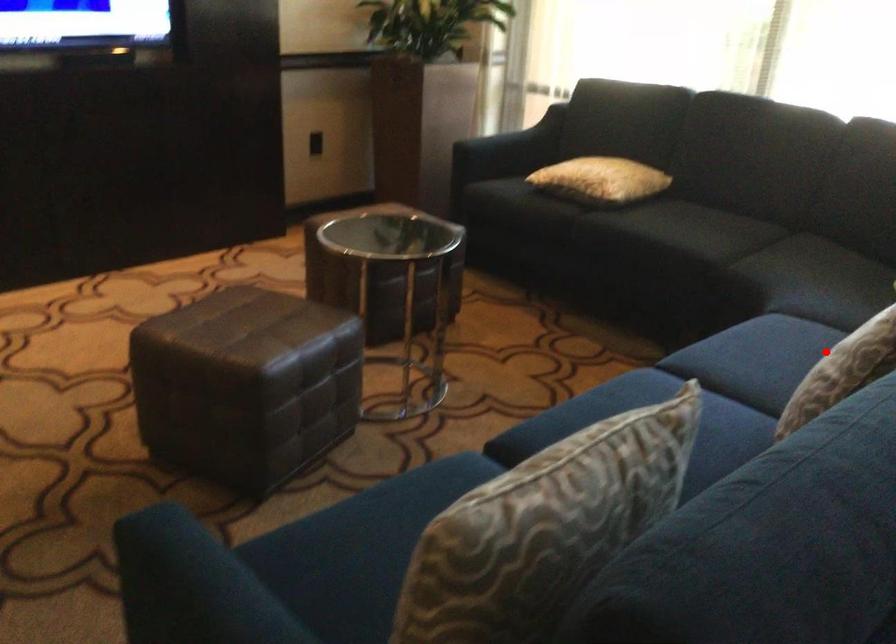
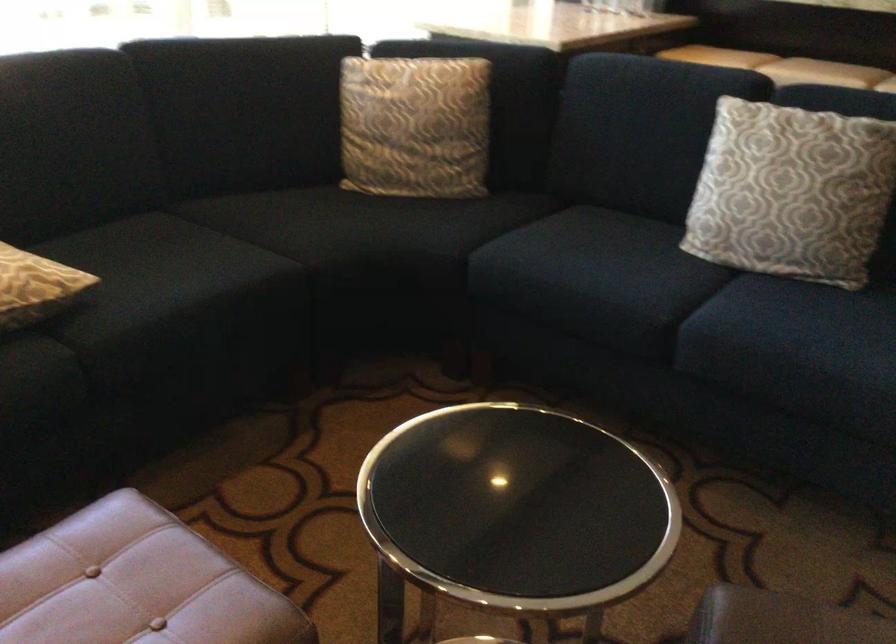
Locate, in the second image, the point that corresponds to the highlighted location in the first image.

(791, 192)